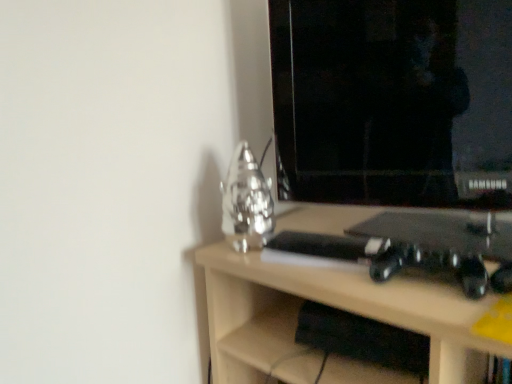
Question: Could you tell me if black glossy monitor at upper right is turned towards light wood desk at center?

Choices:
 (A) yes
 (B) no

Answer: (B)

Question: Is black glossy monitor at upper right in front of light wood desk at center?

Choices:
 (A) yes
 (B) no

Answer: (B)

Question: Considering the relative positions of black glossy monitor at upper right and light wood desk at center in the image provided, is black glossy monitor at upper right to the left of light wood desk at center from the viewer's perspective?

Choices:
 (A) yes
 (B) no

Answer: (A)

Question: Can you confirm if black glossy monitor at upper right is smaller than light wood desk at center?

Choices:
 (A) no
 (B) yes

Answer: (B)

Question: Considering the relative sizes of black glossy monitor at upper right and light wood desk at center in the image provided, is black glossy monitor at upper right wider than light wood desk at center?

Choices:
 (A) no
 (B) yes

Answer: (A)

Question: Does black glossy monitor at upper right have a lesser width compared to light wood desk at center?

Choices:
 (A) yes
 (B) no

Answer: (A)

Question: Is light wood desk at center bigger than black glossy monitor at upper right?

Choices:
 (A) yes
 (B) no

Answer: (A)

Question: Considering the relative sizes of light wood desk at center and black glossy monitor at upper right in the image provided, is light wood desk at center taller than black glossy monitor at upper right?

Choices:
 (A) yes
 (B) no

Answer: (A)

Question: Considering the relative sizes of light wood desk at center and black glossy monitor at upper right in the image provided, is light wood desk at center wider than black glossy monitor at upper right?

Choices:
 (A) yes
 (B) no

Answer: (A)

Question: Would you say light wood desk at center is outside black glossy monitor at upper right?

Choices:
 (A) no
 (B) yes

Answer: (B)

Question: From the image's perspective, is light wood desk at center below black glossy monitor at upper right?

Choices:
 (A) yes
 (B) no

Answer: (A)

Question: Is light wood desk at center facing away from black glossy monitor at upper right?

Choices:
 (A) no
 (B) yes

Answer: (A)

Question: Considering the relative positions of black glossy monitor at upper right and light wood desk at center in the image provided, is black glossy monitor at upper right to the left or to the right of light wood desk at center?

Choices:
 (A) right
 (B) left

Answer: (B)